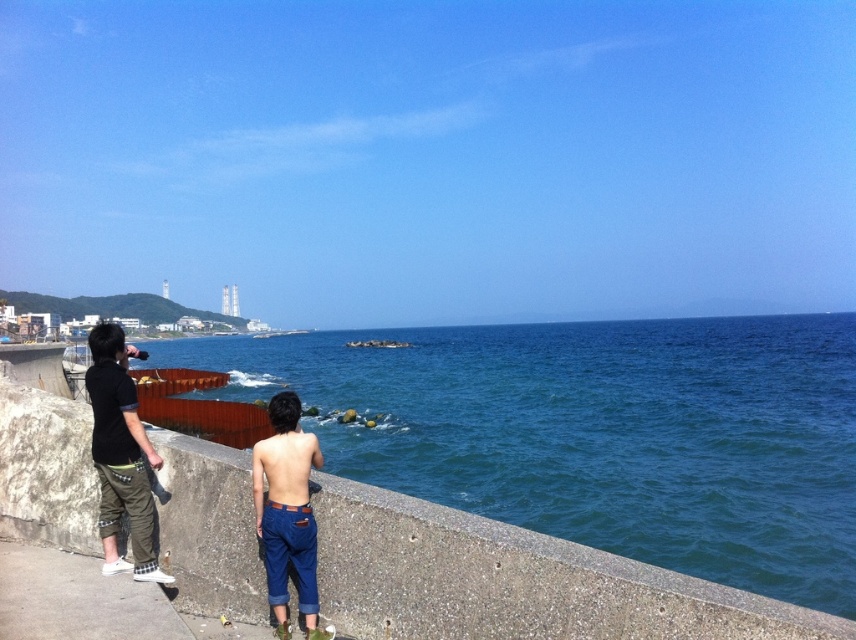
Question: Which of the following is the farthest from the observer?

Choices:
 (A) denim pants at center
 (B) black cotton shirt at left

Answer: (B)

Question: Can you confirm if blue water at center is smaller than black cotton shirt at left?

Choices:
 (A) yes
 (B) no

Answer: (B)

Question: Can you confirm if blue water at center is smaller than denim pants at center?

Choices:
 (A) yes
 (B) no

Answer: (B)

Question: Considering the real-world distances, which object is closest to the blue water at center?

Choices:
 (A) denim pants at center
 (B) black cotton shirt at left

Answer: (B)

Question: Based on their relative distances, which object is farther from the denim pants at center?

Choices:
 (A) blue water at center
 (B) black cotton shirt at left

Answer: (A)

Question: Is blue water at center above black cotton shirt at left?

Choices:
 (A) yes
 (B) no

Answer: (A)